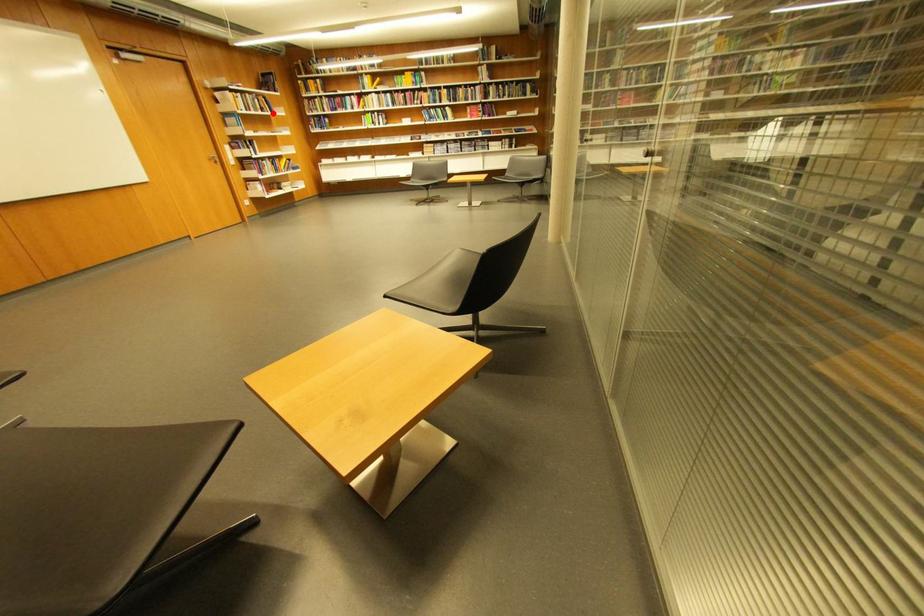
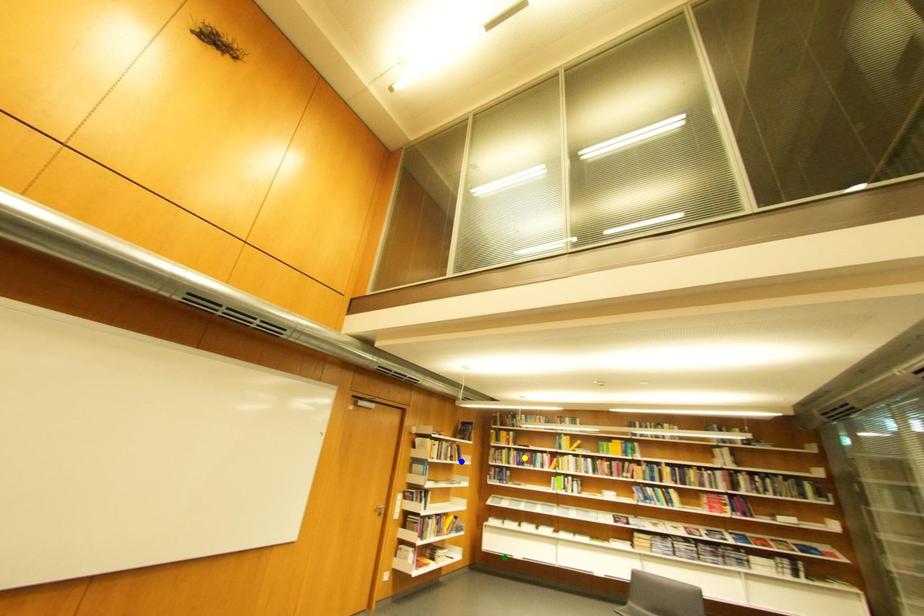
Question: I am providing you with two images of the same scene from different viewpoints. A red point is marked on the first image. You are given multiple points on the second image. Which mark in image 2 goes with the point in image 1?

Choices:
 (A) green point
 (B) yellow point
 (C) blue point

Answer: (C)